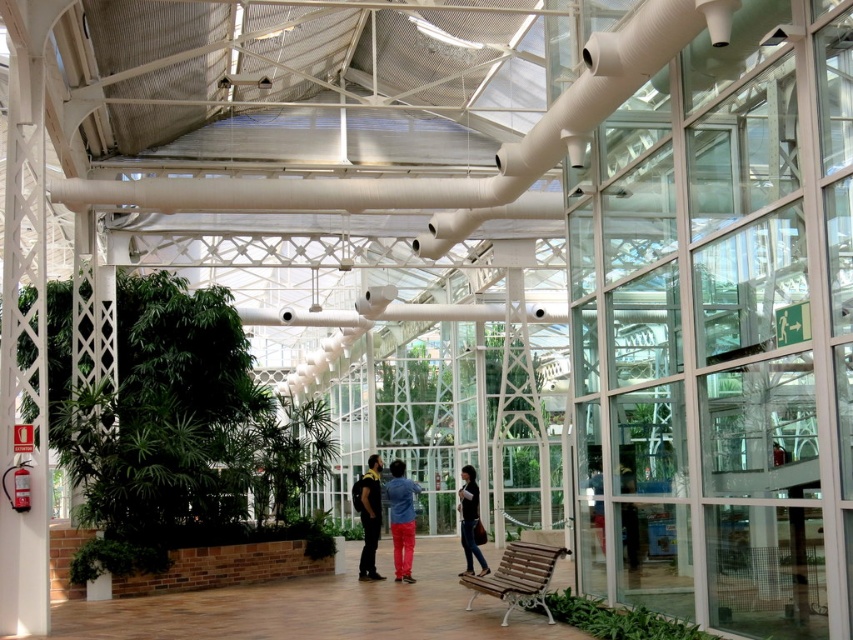
Question: Among these points, which one is farthest from the camera?

Choices:
 (A) (474, 486)
 (B) (387, 467)
 (C) (299, 474)

Answer: (B)

Question: Considering the real-world distances, which object is closest to the green leafy plant at left?

Choices:
 (A) brown wooden bench at lower right
 (B) dark blue jeans at center
 (C) denim jacket at center
 (D) black matte shirt at center

Answer: (D)

Question: Which point is closer to the camera?

Choices:
 (A) green leafy plant at lower right
 (B) brown wooden bench at lower right
 (C) black matte shirt at center
 (D) green leafy plant at left

Answer: (A)

Question: Can you confirm if green leafy plant at left is positioned above dark blue jeans at center?

Choices:
 (A) no
 (B) yes

Answer: (A)

Question: Is brown wooden bench at lower right thinner than black matte shirt at center?

Choices:
 (A) yes
 (B) no

Answer: (B)

Question: Does green leafy plant at left have a greater width compared to dark blue jeans at center?

Choices:
 (A) yes
 (B) no

Answer: (A)